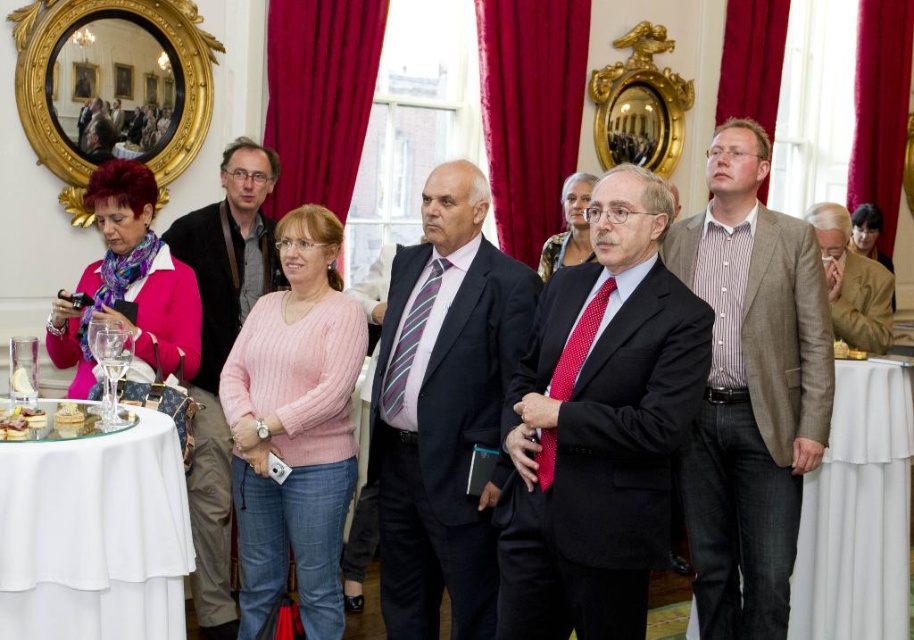
This screenshot has width=914, height=640. Describe the element at coordinates (222, 353) in the screenshot. I see `matte black jacket at center` at that location.

Identify the location of matte black jacket at center. The width and height of the screenshot is (914, 640). (222, 353).

Based on the photo, does matte black suit at center have a greater height compared to dark blue suit at center?

No.

How distant is matte black suit at center from dark blue suit at center?

20.01 inches

In order to click on matte black suit at center in this screenshot , I will do coord(599,426).

Find the location of `matte black suit at center`. matte black suit at center is located at coordinates (599, 426).

Is matte black suit at center smaller than white cloth-covered table at lower left?

Actually, matte black suit at center might be larger than white cloth-covered table at lower left.

What do you see at coordinates (599, 426) in the screenshot? I see `matte black suit at center` at bounding box center [599, 426].

Locate an element on the screen. The height and width of the screenshot is (640, 914). matte black suit at center is located at coordinates (599, 426).

Find the location of a particular element. matte black suit at center is located at coordinates (599, 426).